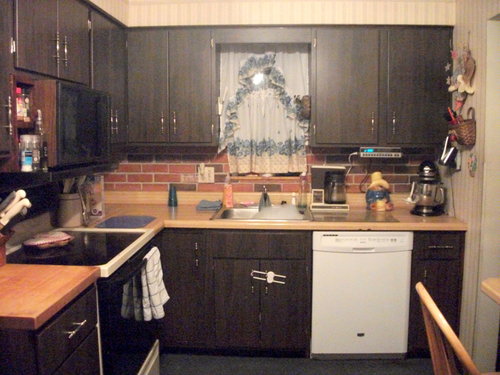
Find the location of a particular element. The image size is (500, 375). coffee maker is located at coordinates (332, 190).